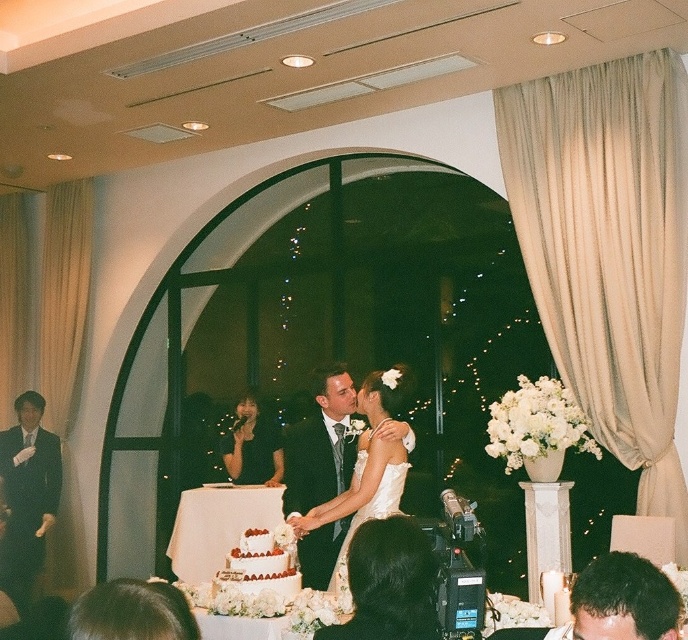
Does matte black suit at center appear under white satin dress at center?

Yes, matte black suit at center is below white satin dress at center.

Can you confirm if matte black suit at center is bigger than white satin dress at center?

Actually, matte black suit at center might be smaller than white satin dress at center.

Between point (301, 449) and point (380, 456), which one is positioned in front?

Point (380, 456) is more forward.

The image size is (688, 640). In order to click on matte black suit at center in this screenshot , I will do `click(321, 444)`.

Is point (394, 388) farther from camera compared to point (272, 433)?

No.

Is white satin dress at center to the right of black satin dress at center from the viewer's perspective?

Correct, you'll find white satin dress at center to the right of black satin dress at center.

Find the location of a particular element. The image size is (688, 640). white satin dress at center is located at coordinates (365, 474).

The image size is (688, 640). I want to click on white satin dress at center, so click(x=365, y=474).

Does matte black suit at center appear on the right side of black satin dress at center?

Yes, matte black suit at center is to the right of black satin dress at center.

Is matte black suit at center bigger than black satin dress at center?

Incorrect, matte black suit at center is not larger than black satin dress at center.

Who is more forward, (333, 547) or (241, 483)?

Point (333, 547) is in front.

Identify the location of matte black suit at center. The width and height of the screenshot is (688, 640). (321, 444).